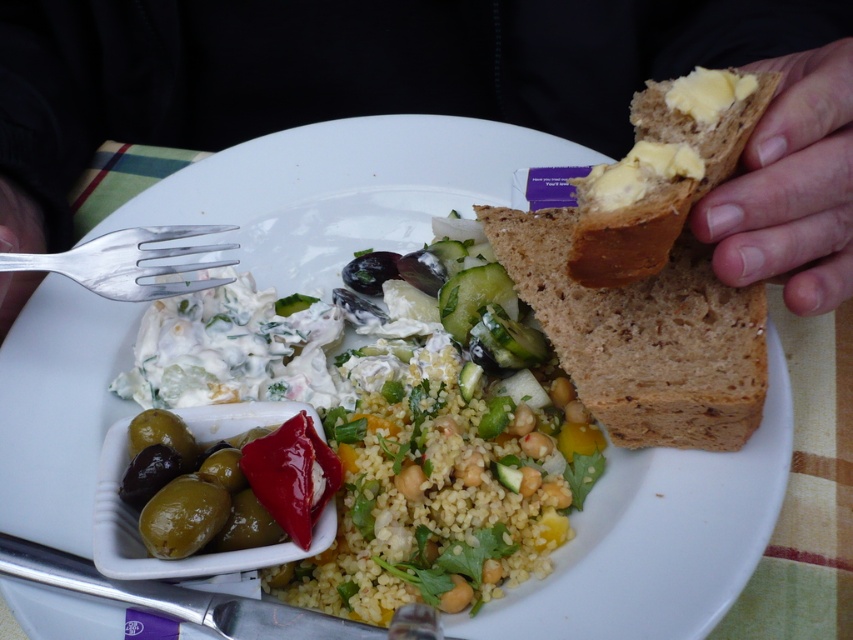
You are a food critic analyzing the arrangement of dishes on a white plate. The plate has a small white dish with green olives and red pepper on the left side, a creamy white dip with herbs and vegetables next to it, and a salad of couscous, chickpeas, cucumber, and herbs in the center. There is also a point labeled at coordinates (791, 186). What object is located at this coordinate?

The point at (791, 186) corresponds to the brown matte bread at the right.

You are at a restaurant and want to spread the yellow creamy cheese at upper right onto the brown matte bread at right. Which direction should you move the cheese to reach the bread?

The brown matte bread at right is to the right of the yellow creamy cheese at upper right, so you should move the cheese to the right to reach the bread.

You are a chef preparing a meal and need to place both the brown bread at right and the green crisp pickle at center onto a small plate that can only hold items up to 10 cm in width. Based on their sizes, which item might not fit?

The brown bread at right has a larger width than the green crisp pickle at center, so the brown bread at right might not fit on the small plate if its width exceeds 10 cm.